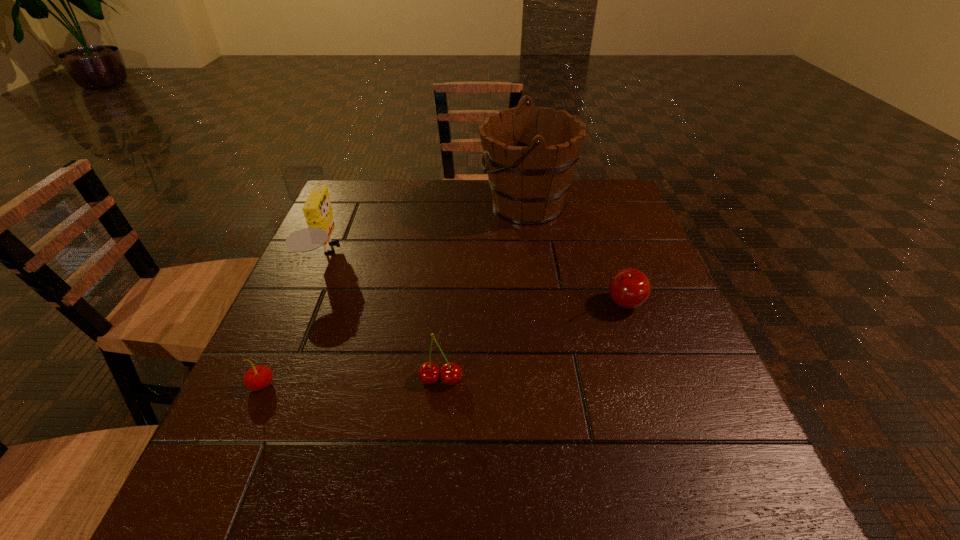
Identify the location of unoccupied area between the farthest cherry and the shortest cherry. (443, 344).

I want to click on vacant area between the shortest cherry and the fourth shortest object, so click(x=294, y=320).

Where is `free space between the rightmost cherry and the shortest cherry`? free space between the rightmost cherry and the shortest cherry is located at coordinates (443, 344).

Locate an element on the screen. free space that is in between the shortest object and the tallest object is located at coordinates (394, 295).

Locate an element on the screen. This screenshot has width=960, height=540. free area in between the wine bucket and the farthest cherry is located at coordinates (574, 254).

Image resolution: width=960 pixels, height=540 pixels. I want to click on free area in between the second tallest object and the shortest object, so (x=294, y=320).

This screenshot has width=960, height=540. In order to click on vacant area between the shortest object and the sponge in this screenshot , I will do `click(294, 320)`.

This screenshot has height=540, width=960. I want to click on the closest object to the rightmost cherry, so click(530, 156).

Locate which object is the third closest to the shortest cherry. Please provide its 2D coordinates. Your answer should be formatted as a tuple, i.e. [(x, y)], where the tuple contains the x and y coordinates of a point satisfying the conditions above.

[(530, 156)]

Choose which cherry is the second nearest neighbor to the tallest object. Please provide its 2D coordinates. Your answer should be formatted as a tuple, i.e. [(x, y)], where the tuple contains the x and y coordinates of a point satisfying the conditions above.

[(429, 373)]